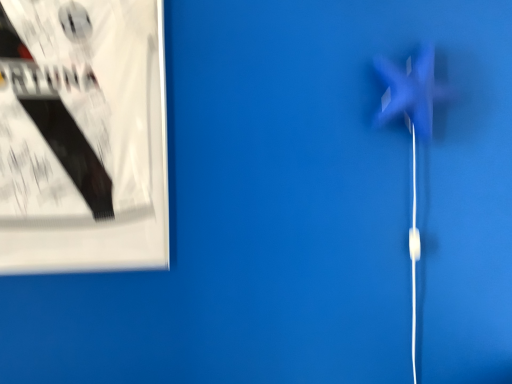
Where is `white paper at upper left`? The width and height of the screenshot is (512, 384). white paper at upper left is located at coordinates (84, 138).

This screenshot has width=512, height=384. What do you see at coordinates (84, 138) in the screenshot? I see `white paper at upper left` at bounding box center [84, 138].

Identify the location of white paper at upper left. This screenshot has height=384, width=512. (84, 138).